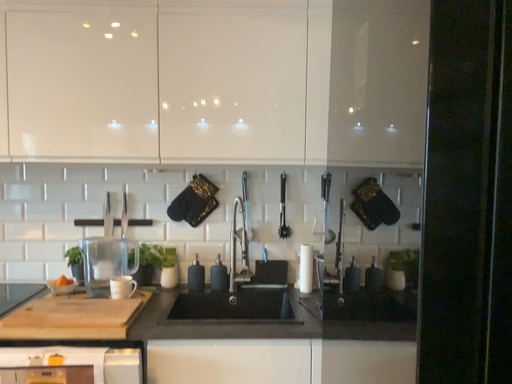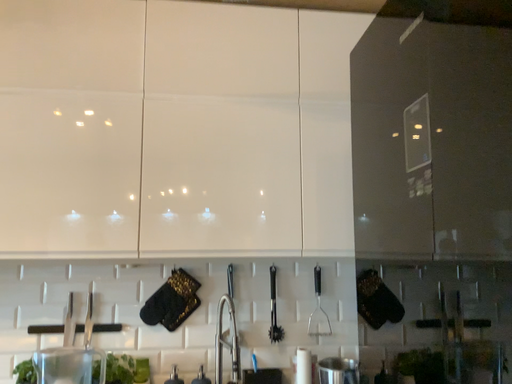
Question: How did the camera likely rotate when shooting the video?

Choices:
 (A) rotated downward
 (B) rotated upward

Answer: (B)